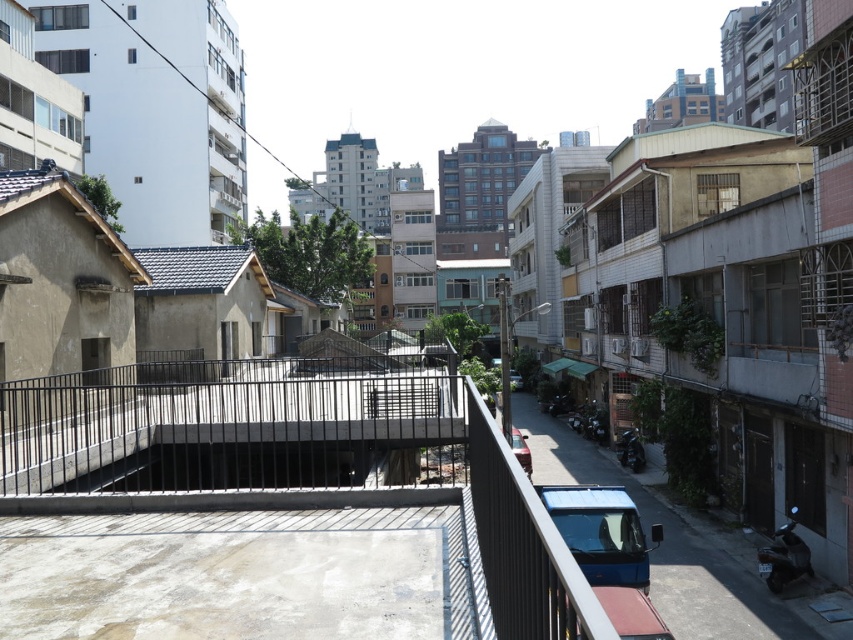
Question: Does black metal railing at center have a greater width compared to metallic silver car at center?

Choices:
 (A) yes
 (B) no

Answer: (A)

Question: Considering the real-world distances, which object is farthest from the silver metallic car at center?

Choices:
 (A) blue metallic van at lower right
 (B) black metal railing at center
 (C) metallic silver car at center

Answer: (A)

Question: Can you confirm if blue metallic van at lower right is bigger than silver metallic car at center?

Choices:
 (A) yes
 (B) no

Answer: (B)

Question: Estimate the real-world distances between objects in this image. Which object is closer to the metallic silver car at center?

Choices:
 (A) black metal railing at center
 (B) blue metallic van at lower right

Answer: (B)

Question: Where is black metal railing at center located in relation to blue metallic van at lower right in the image?

Choices:
 (A) below
 (B) above

Answer: (B)

Question: Which of the following is the closest to the observer?

Choices:
 (A) blue metallic van at lower right
 (B) black metal railing at center
 (C) silver metallic car at center
 (D) metallic silver car at center

Answer: (B)